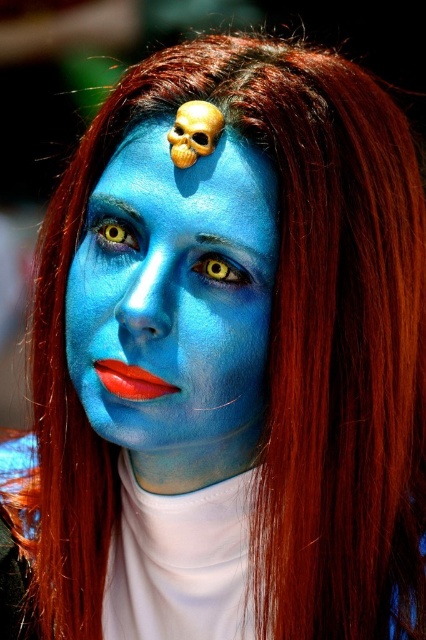
Who is higher up, blue matte face paint at center or yellow matte eye at center?

Positioned higher is yellow matte eye at center.

Between point (146, 500) and point (230, 280), which one is positioned in front?

Point (230, 280)

This screenshot has width=426, height=640. I want to click on blue matte face paint at center, so click(x=181, y=563).

Does blue matte face paint at center appear under yellow matte eye at upper left?

Correct, blue matte face paint at center is located below yellow matte eye at upper left.

Who is more forward, (238, 570) or (112, 236)?

Positioned in front is point (112, 236).

Where is `blue matte face paint at center`? This screenshot has width=426, height=640. blue matte face paint at center is located at coordinates (181, 563).

Can you confirm if blue matte face at center is bigger than blue matte face paint at center?

Incorrect, blue matte face at center is not larger than blue matte face paint at center.

Who is higher up, blue matte face at center or blue matte face paint at center?

blue matte face at center is above.

Does point (109, 294) come closer to viewer compared to point (244, 618)?

Yes, point (109, 294) is in front of point (244, 618).

At what (x,y) coordinates should I click in order to perform the action: click on blue matte face at center. Please return your answer as a coordinate pair (x, y). Looking at the image, I should click on click(x=175, y=298).